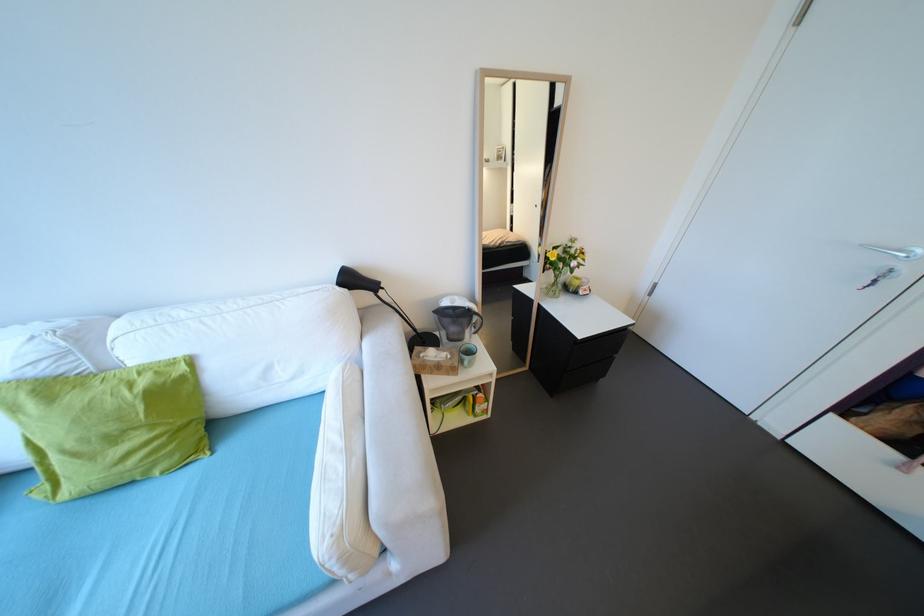
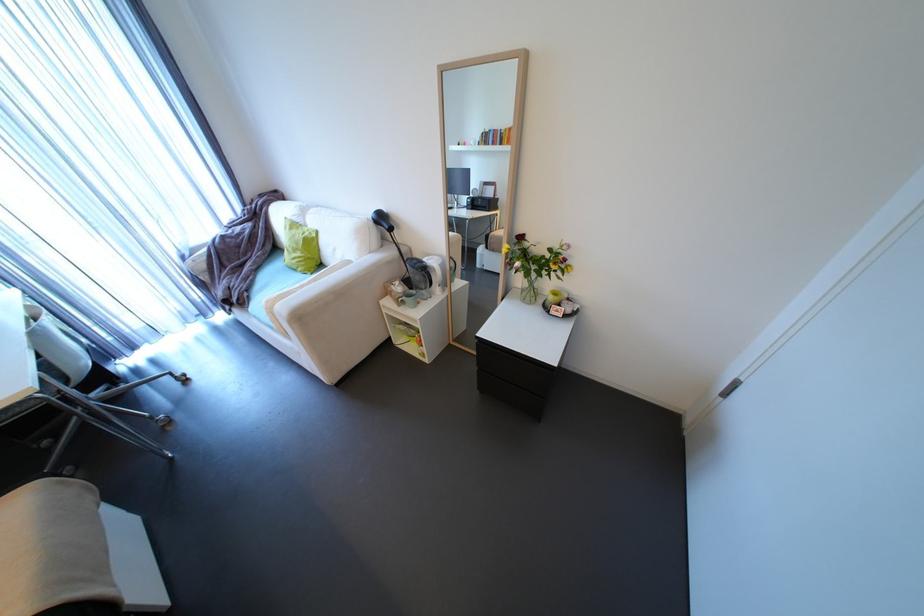
The point at (160, 428) is marked in the first image. Where is the corresponding point in the second image?

(310, 253)